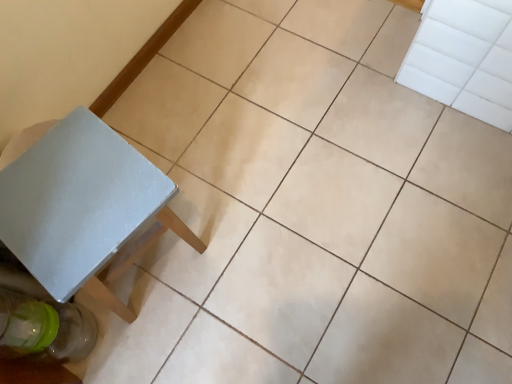
You are a GUI agent. You are given a task and a screenshot of the screen. Output one action in this format:
    pyautogui.click(x=<x>, y=<y>)
    Task: Click on the vacant area that is situated to the right of transparent glass bottle at lower left
    
    Given the screenshot: What is the action you would take?
    pyautogui.click(x=136, y=331)